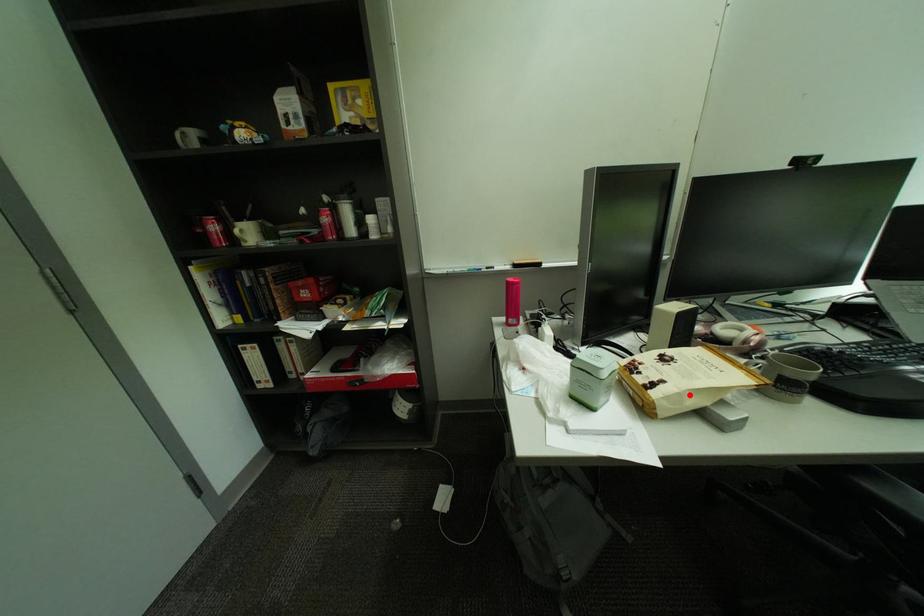
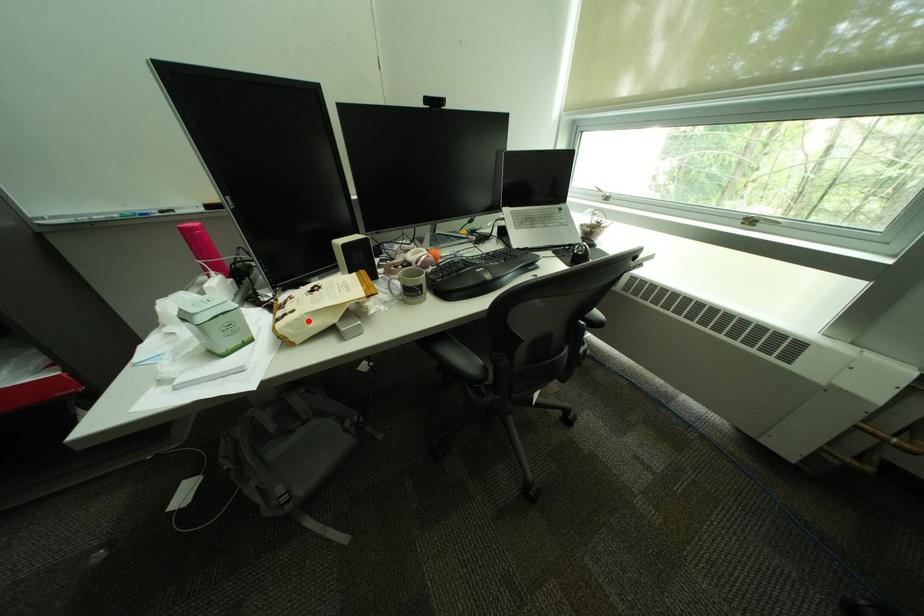
I am providing you with two images of the same scene from different viewpoints. A red point is marked on the first image and another point is marked on the second image. Do the highlighted points in image1 and image2 indicate the same real-world spot?

Yes